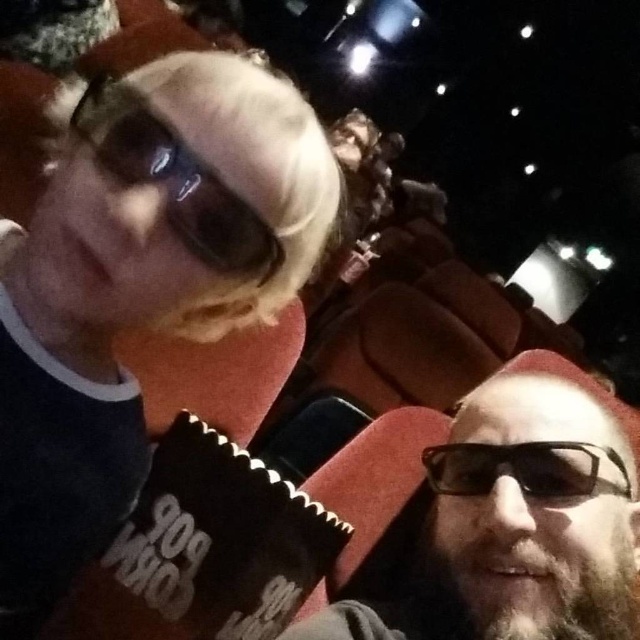
Question: Which of the following is the closest to the observer?

Choices:
 (A) (192, 252)
 (B) (480, 627)

Answer: (A)

Question: Can you confirm if bearddark brown/thickfacial hair at right is positioned above black plastic glasses at lower right?

Choices:
 (A) no
 (B) yes

Answer: (A)

Question: Is matte black beard at lower right closer to camera compared to matte black goggles at upper left?

Choices:
 (A) no
 (B) yes

Answer: (A)

Question: Can you confirm if matte black sunglasses at upper left is smaller than matte black goggles at upper left?

Choices:
 (A) no
 (B) yes

Answer: (A)

Question: Estimate the real-world distances between objects in this image. Which object is farther from the bearddark brown/thickfacial hair at right?

Choices:
 (A) matte black sunglasses at upper left
 (B) black plastic glasses at lower right
 (C) matte black goggles at upper left
 (D) matte black beard at lower right

Answer: (A)

Question: Which point appears farthest from the camera in this image?

Choices:
 (A) (252, 209)
 (B) (572, 627)
 (C) (438, 480)

Answer: (C)